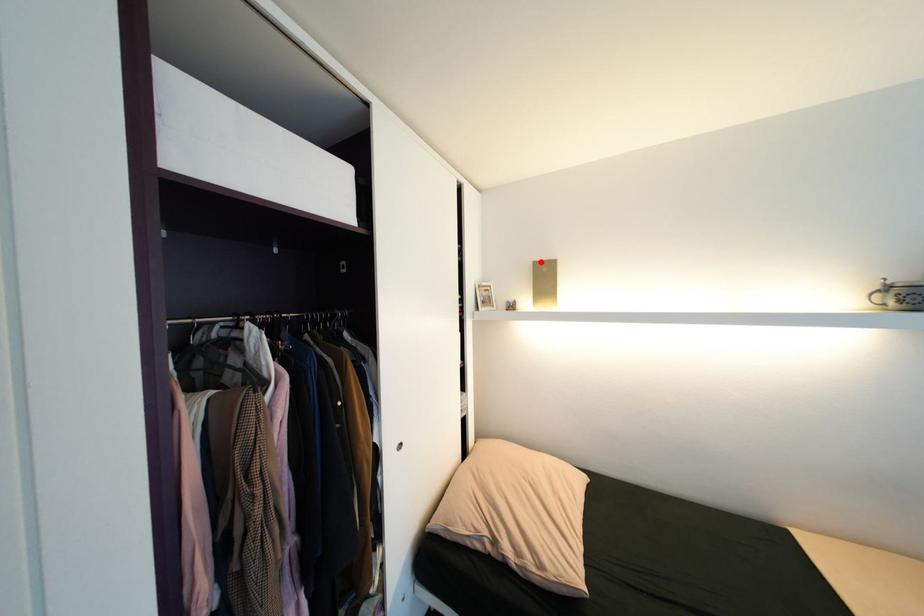
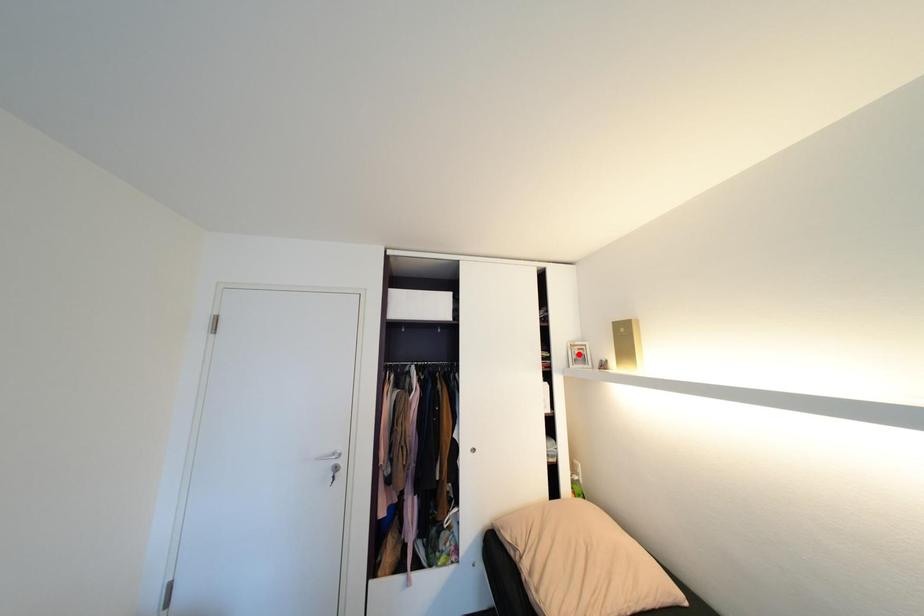
I am providing you with two images of the same scene from different viewpoints. A red point is marked on the first image and another point is marked on the second image. Does the point marked in image1 correspond to the same location as the one in image2?

No